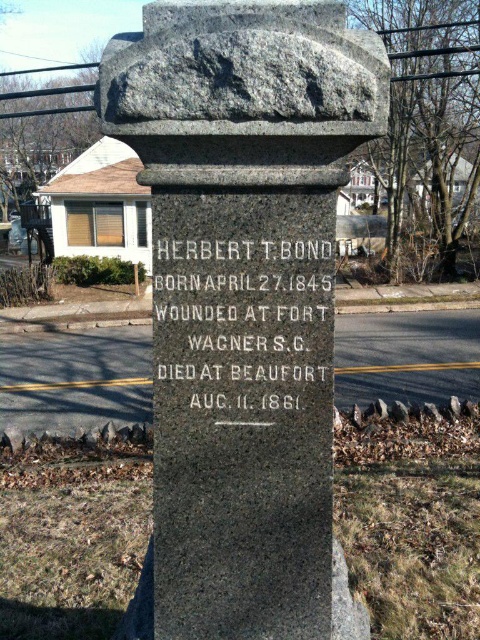
Question: In this image, where is granite stone monument at center located relative to black granite stone at center?

Choices:
 (A) left
 (B) right

Answer: (A)

Question: Can you confirm if granite stone monument at center is positioned to the right of black granite stone at center?

Choices:
 (A) no
 (B) yes

Answer: (A)

Question: Can you confirm if granite stone monument at center is positioned below black granite stone at center?

Choices:
 (A) no
 (B) yes

Answer: (B)

Question: Among these objects, which one is farthest from the camera?

Choices:
 (A) black granite stone at center
 (B) granite stone monument at center

Answer: (A)